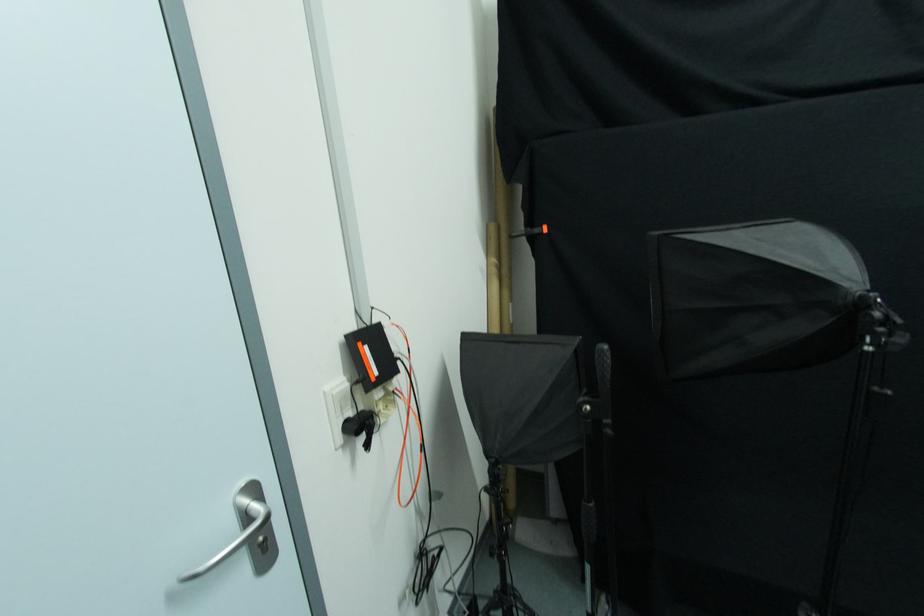
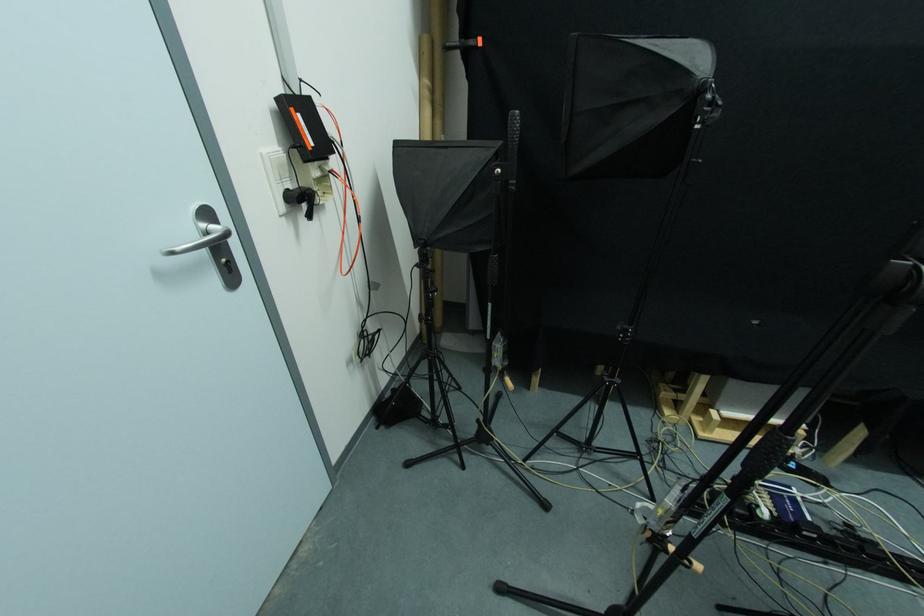
Where in the second image is the point corresponding to [262,541] from the first image?

(226, 262)